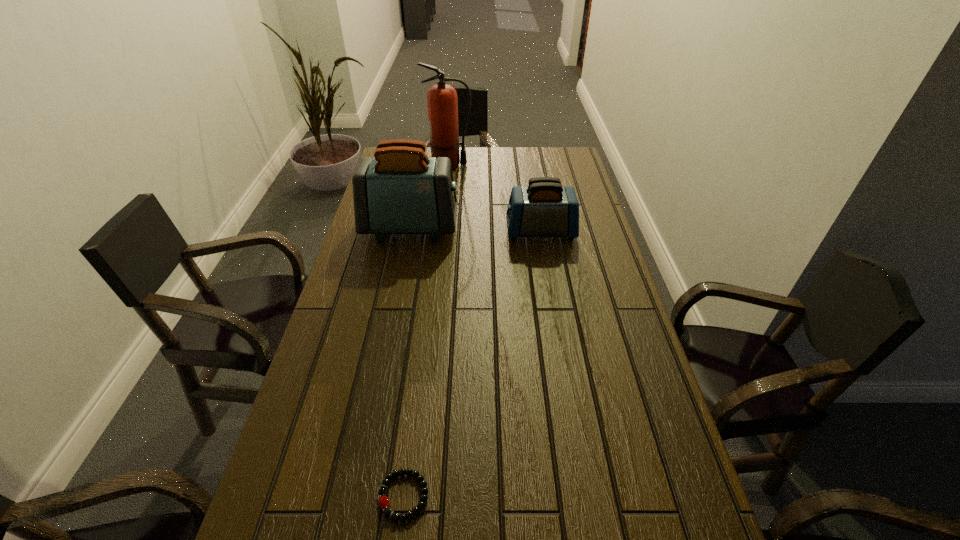
Where is `vacant region that satisfies the following two spatial constraints: 1. on the front-facing side of the taller toaster; 2. on the left side of the shortest object`? vacant region that satisfies the following two spatial constraints: 1. on the front-facing side of the taller toaster; 2. on the left side of the shortest object is located at coordinates (357, 496).